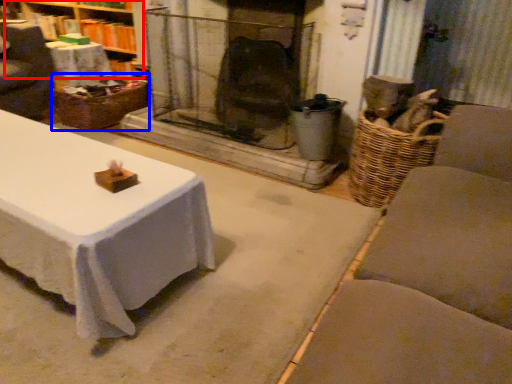
Question: Among these objects, which one is nearest to the camera, bookshelf (highlighted by a red box) or basket (highlighted by a blue box)?

Choices:
 (A) bookshelf
 (B) basket

Answer: (B)